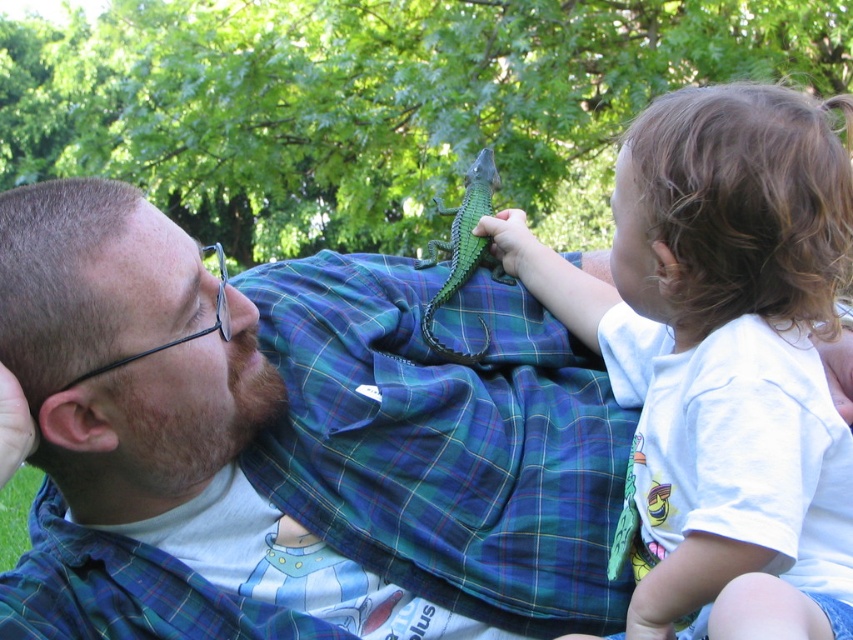
Question: Is green matte toy lizard at upper center positioned before curly brown hair at upper right?

Choices:
 (A) no
 (B) yes

Answer: (A)

Question: Does green matte toy lizard at upper center appear under green matte toy lizard at center?

Choices:
 (A) yes
 (B) no

Answer: (A)

Question: Which of these objects is positioned farthest from the curly brown hair at upper right?

Choices:
 (A) green matte toy lizard at upper center
 (B) green matte toy lizard at center

Answer: (B)

Question: Estimate the real-world distances between objects in this image. Which object is farther from the green matte toy lizard at upper center?

Choices:
 (A) curly brown hair at upper right
 (B) green matte toy lizard at center

Answer: (A)

Question: Is green matte toy lizard at upper center to the left of green matte toy lizard at center from the viewer's perspective?

Choices:
 (A) yes
 (B) no

Answer: (A)

Question: Which point is farther to the camera?

Choices:
 (A) (341, 308)
 (B) (480, 176)

Answer: (B)